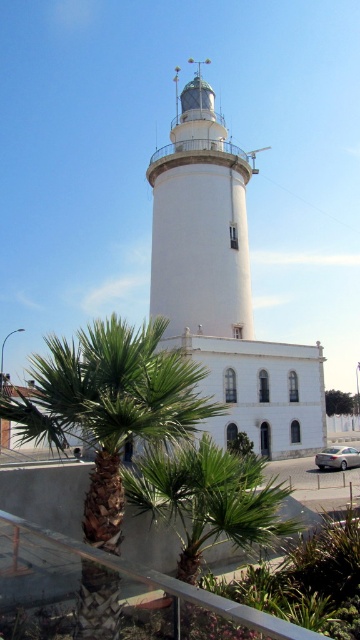
Who is shorter, white smooth lighthouse at center or green leafy tree at lower center?

green leafy tree at lower center

Is white smooth lighthouse at center in front of green leafy tree at lower center?

Yes, white smooth lighthouse at center is closer to the viewer.

Is point (159, 182) positioned before point (327, 406)?

Yes, point (159, 182) is closer to viewer.

Locate an element on the screen. Image resolution: width=360 pixels, height=640 pixels. white smooth lighthouse at center is located at coordinates (200, 221).

Between green leafy palm at lower center and green leafy tree at lower center, which one is positioned lower?

green leafy tree at lower center

Looking at this image, is green leafy palm at lower center to the right of green leafy tree at lower center from the viewer's perspective?

Incorrect, green leafy palm at lower center is not on the right side of green leafy tree at lower center.

Does point (42, 410) come closer to viewer compared to point (335, 388)?

Yes, it is.

Identify the location of green leafy palm at lower center. The height and width of the screenshot is (640, 360). (110, 406).

Between green leafy palm at lower center and white smooth lighthouse at center, which one has more height?

white smooth lighthouse at center is taller.

Who is higher up, green leafy palm at lower center or white smooth lighthouse at center?

white smooth lighthouse at center is above.

Which is in front, point (108, 628) or point (176, 324)?

Positioned in front is point (108, 628).

The image size is (360, 640). I want to click on green leafy palm at lower center, so click(110, 406).